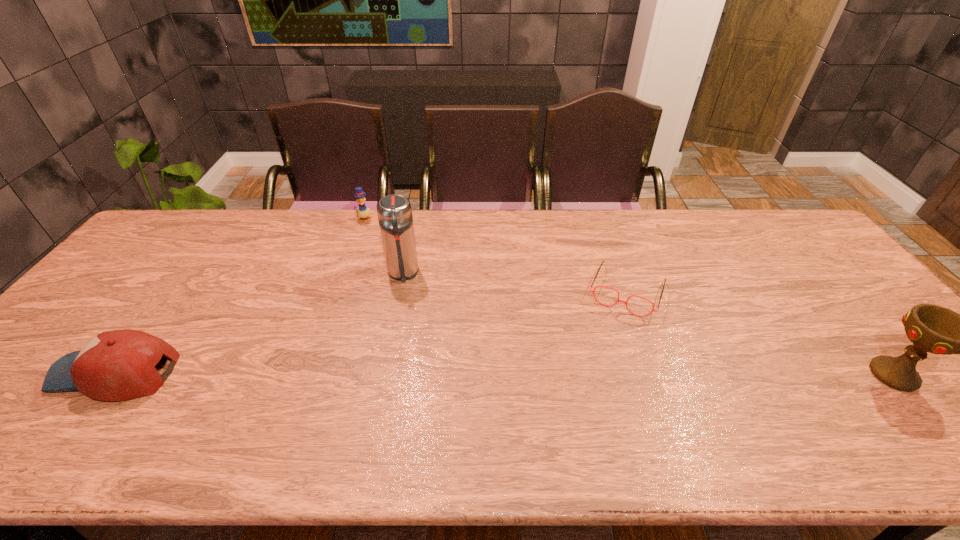
At what (x,y) coordinates should I click in order to perform the action: click on free space on the desktop that is between the leftmost object and the second tallest object and is positioned on the face of the duckling, where the monocle is placed. Please return your answer as a coordinate pair (x, y). Looking at the image, I should click on (395, 374).

What are the coordinates of `vacant space on the desktop that is between the leftmost object and the rightmost object and is positioned with a handle on the side of the thermos bottle` in the screenshot? It's located at (407, 374).

In order to click on vacant space on the desktop that is between the leftmost object and the fourth shortest object and is positioned on the front-facing side of the shortest object in this screenshot , I will do `click(597, 374)`.